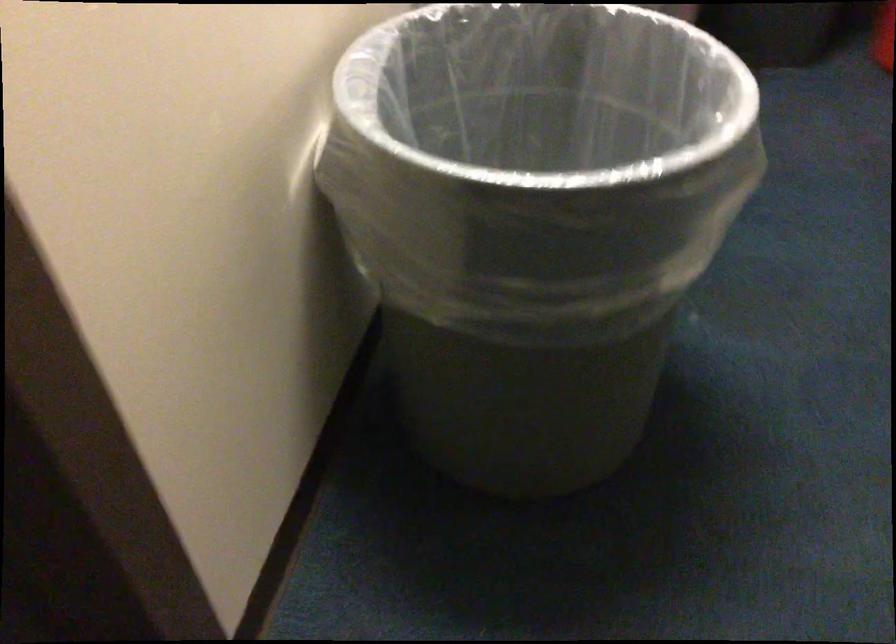
Where is `small trash can`? The width and height of the screenshot is (896, 644). small trash can is located at coordinates (538, 185).